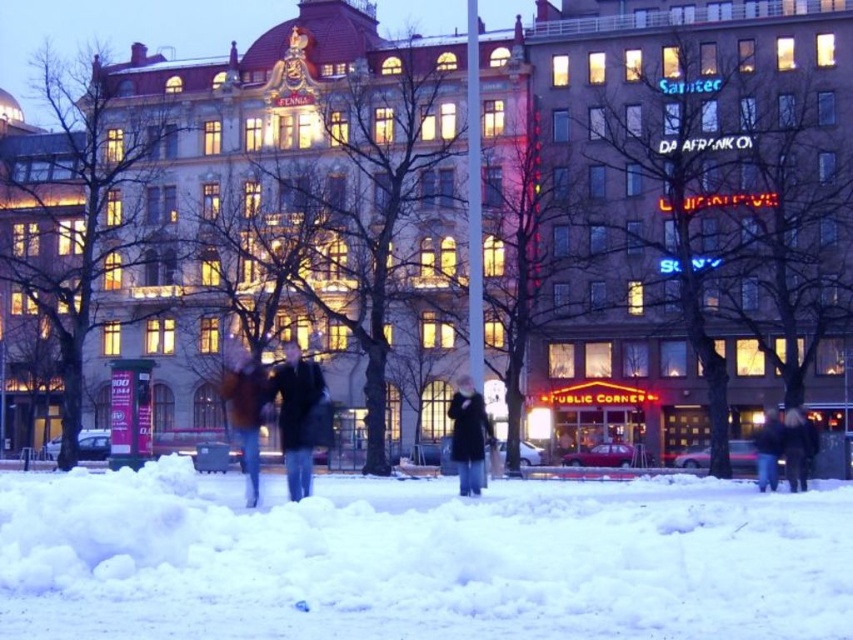
Question: Can you confirm if golden ornate building at center is wider than dark brown fur coat at lower right?

Choices:
 (A) yes
 (B) no

Answer: (A)

Question: Can you confirm if golden ornate building at center is positioned to the left of dark gray coat at center?

Choices:
 (A) no
 (B) yes

Answer: (B)

Question: Does dark brown fur coat at lower right appear on the left side of dark blue jacket at lower right?

Choices:
 (A) no
 (B) yes

Answer: (B)

Question: Which object appears closest to the camera in this image?

Choices:
 (A) dark brown fur coat at lower right
 (B) golden ornate building at center
 (C) brown fuzzy coat at center
 (D) dark blue jeans at center

Answer: (D)

Question: Which is farther from the brick building at right?

Choices:
 (A) white fluffy snow at lower center
 (B) dark blue jeans at center
 (C) dark brown fur coat at lower right
 (D) dark gray coat at center

Answer: (B)

Question: Which object is the closest to the dark brown fur coat at lower right?

Choices:
 (A) brown fuzzy coat at center
 (B) dark blue jeans at center
 (C) brick building at right

Answer: (C)